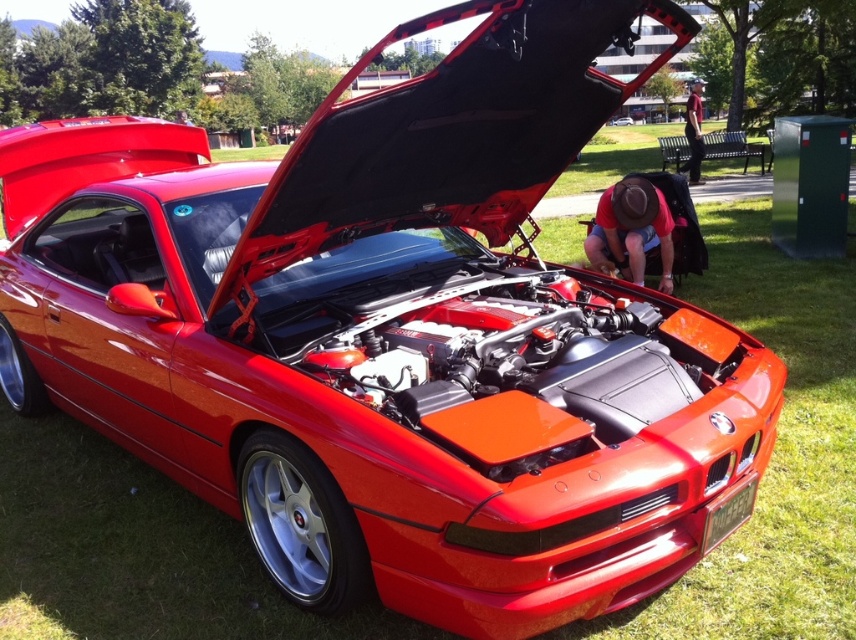
Which is below, red cotton shirt at center or maroon fabric shirt at upper right?

Positioned lower is red cotton shirt at center.

Identify the location of red cotton shirt at center. Image resolution: width=856 pixels, height=640 pixels. (631, 230).